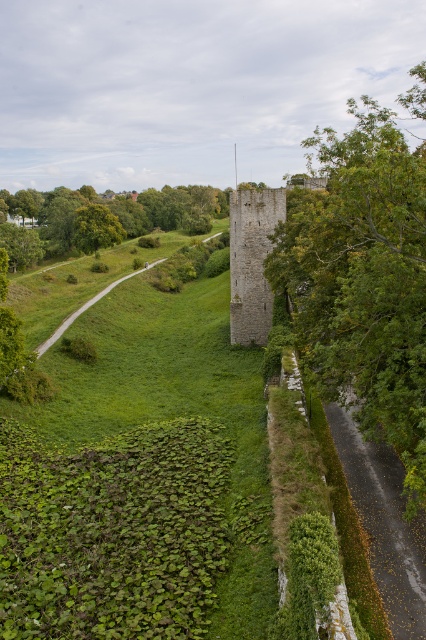
Question: Which object appears farthest from the camera in this image?

Choices:
 (A) green leafy tree at lower left
 (B) green leafy grass at center
 (C) green leafy tree at right

Answer: (A)

Question: Among these points, which one is nearest to the camera?

Choices:
 (A) (152, 221)
 (B) (121, 316)

Answer: (B)

Question: Can you confirm if green leafy grass at center is thinner than green leafy tree at right?

Choices:
 (A) no
 (B) yes

Answer: (B)

Question: Can you confirm if green leafy grass at center is wider than green leafy tree at right?

Choices:
 (A) yes
 (B) no

Answer: (B)

Question: Can you confirm if green leafy grass at center is bigger than green leafy tree at lower left?

Choices:
 (A) no
 (B) yes

Answer: (A)

Question: Which point is closer to the camera taking this photo?

Choices:
 (A) (178, 216)
 (B) (100, 308)
 (C) (288, 253)

Answer: (C)